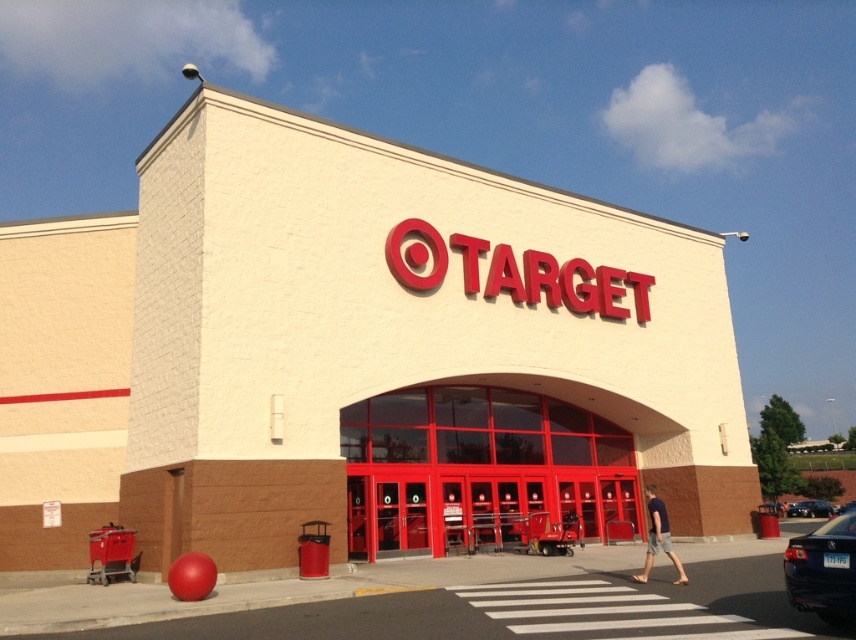
Question: Does black glossy sedan at lower right appear on the right side of shiny black sedan at lower right?

Choices:
 (A) yes
 (B) no

Answer: (B)

Question: Among these objects, which one is nearest to the camera?

Choices:
 (A) shiny glass doors at center
 (B) metallic red shopping cart at lower left

Answer: (B)

Question: Can you confirm if black glossy sedan at lower right is positioned to the right of metallic red shopping cart at lower left?

Choices:
 (A) no
 (B) yes

Answer: (B)

Question: Which point appears farthest from the camera in this image?

Choices:
 (A) (351, 547)
 (B) (107, 529)

Answer: (A)

Question: Is shiny glass doors at center smaller than black glossy sedan at lower right?

Choices:
 (A) yes
 (B) no

Answer: (A)

Question: Which point is closer to the camera?

Choices:
 (A) shiny glass doors at center
 (B) metallic red shopping cart at lower left
 (C) shiny black sedan at lower right

Answer: (B)